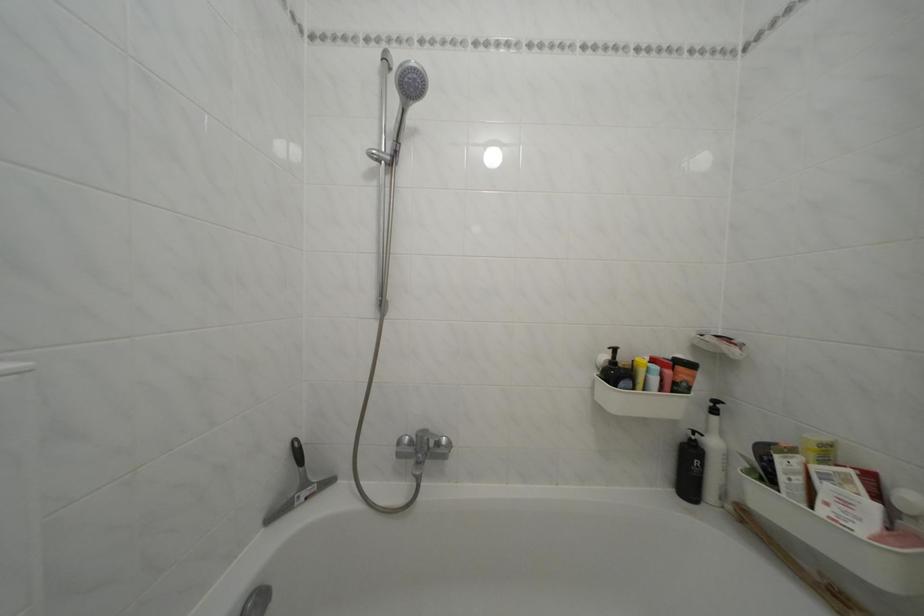
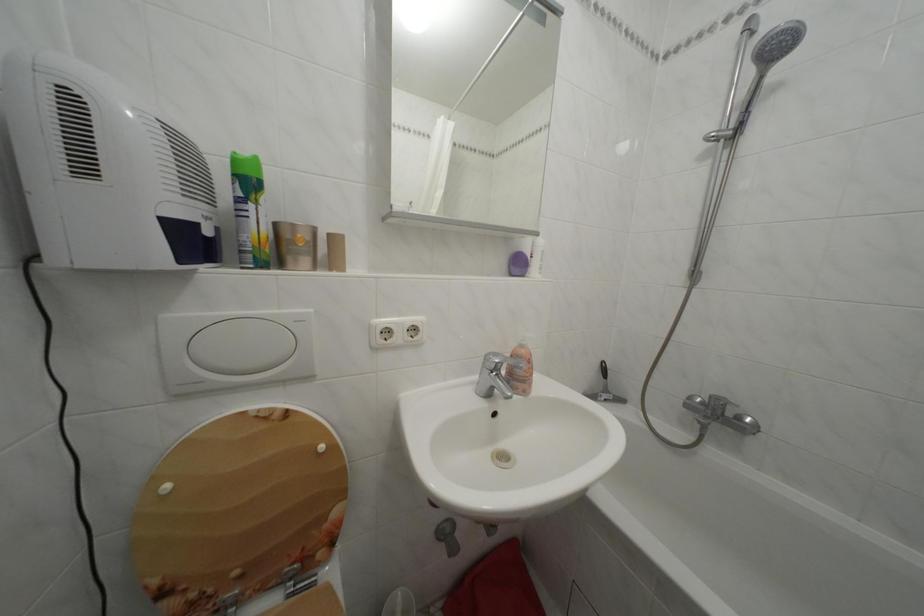
The point at [397,158] is marked in the first image. Where is the corresponding point in the second image?

(742, 132)